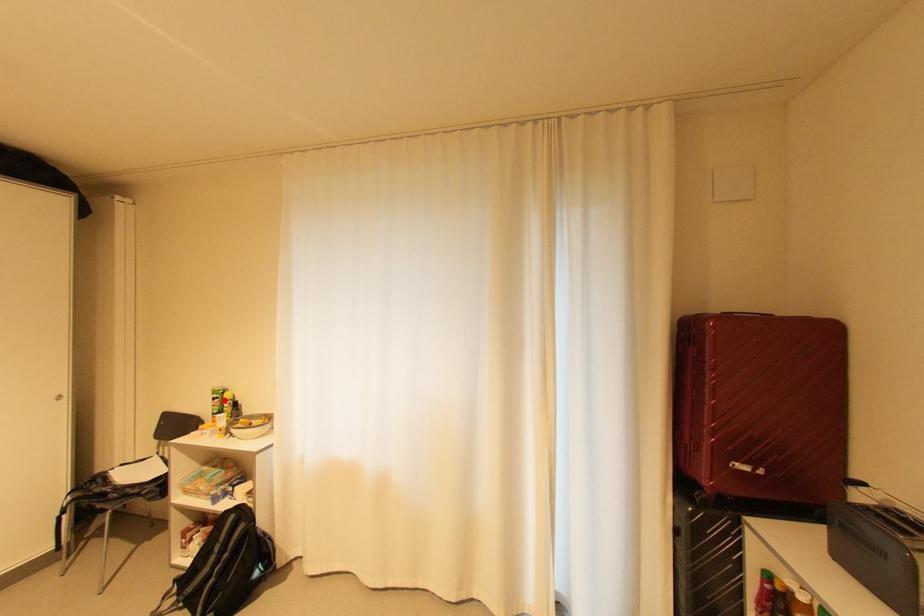
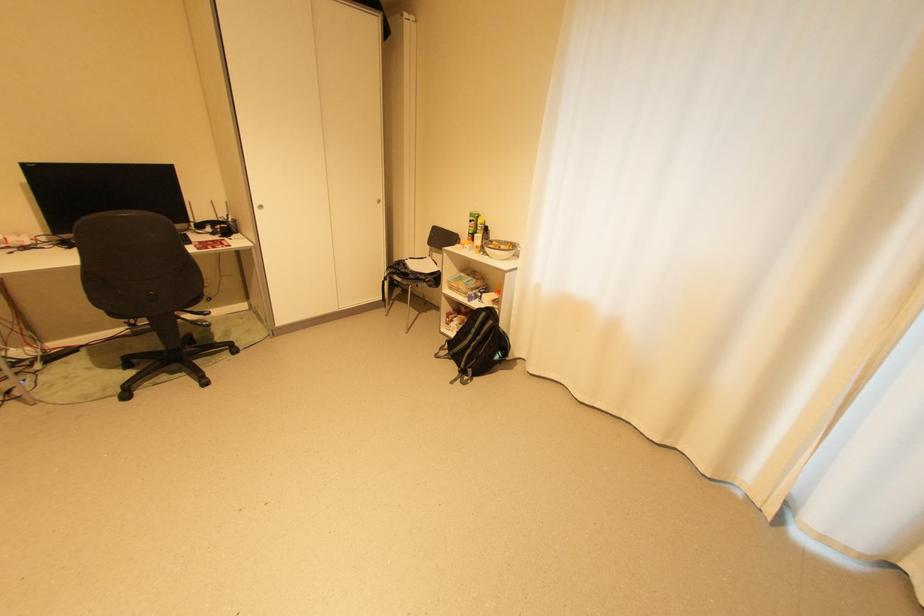
In the second image, find the point that corresponds to the highlighted location in the first image.

(480, 223)